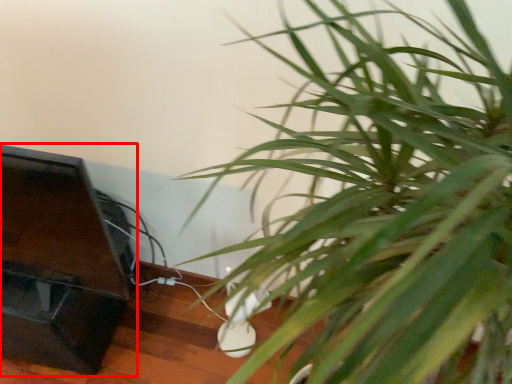
Question: Considering the relative positions of furniture (annotated by the red box) and houseplant in the image provided, where is furniture (annotated by the red box) located with respect to the staircase?

Choices:
 (A) left
 (B) right

Answer: (A)